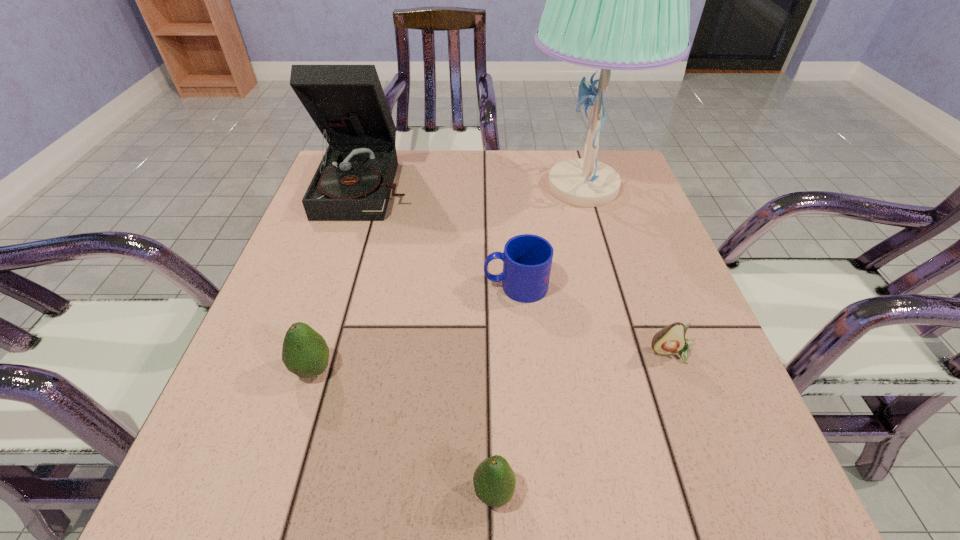
Where is `lamp that is at the right edge`? The height and width of the screenshot is (540, 960). lamp that is at the right edge is located at coordinates (616, 0).

The height and width of the screenshot is (540, 960). In order to click on avocado at the right edge in this screenshot , I will do `click(671, 339)`.

You are a GUI agent. You are given a task and a screenshot of the screen. Output one action in this format:
    pyautogui.click(x=<x>, y=<y>)
    Task: Click on the object located in the far left corner section of the desktop
    The height and width of the screenshot is (540, 960).
    Given the screenshot: What is the action you would take?
    pyautogui.click(x=353, y=182)

Identify the location of object present at the far right corner. The height and width of the screenshot is (540, 960). (616, 0).

Where is `free region at the far edge of the desktop`? free region at the far edge of the desktop is located at coordinates 407,154.

In the image, there is a desktop. Find the location of `free space at the left edge`. free space at the left edge is located at coordinates (288, 269).

In the image, there is a desktop. Where is `free space at the right edge`? This screenshot has width=960, height=540. free space at the right edge is located at coordinates (660, 404).

Identify the location of vacant space at the near left corner. The width and height of the screenshot is (960, 540). (248, 490).

Locate an element on the screen. The width and height of the screenshot is (960, 540). free area in between the lamp and the tallest avocado is located at coordinates (448, 278).

Identify the location of free spot between the lamp and the fifth shortest object. The width and height of the screenshot is (960, 540). (475, 186).